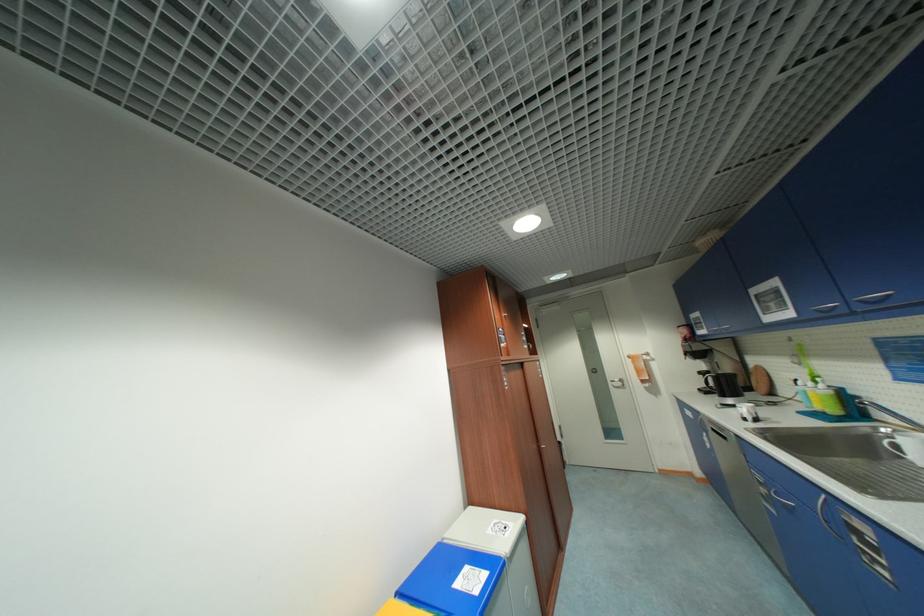
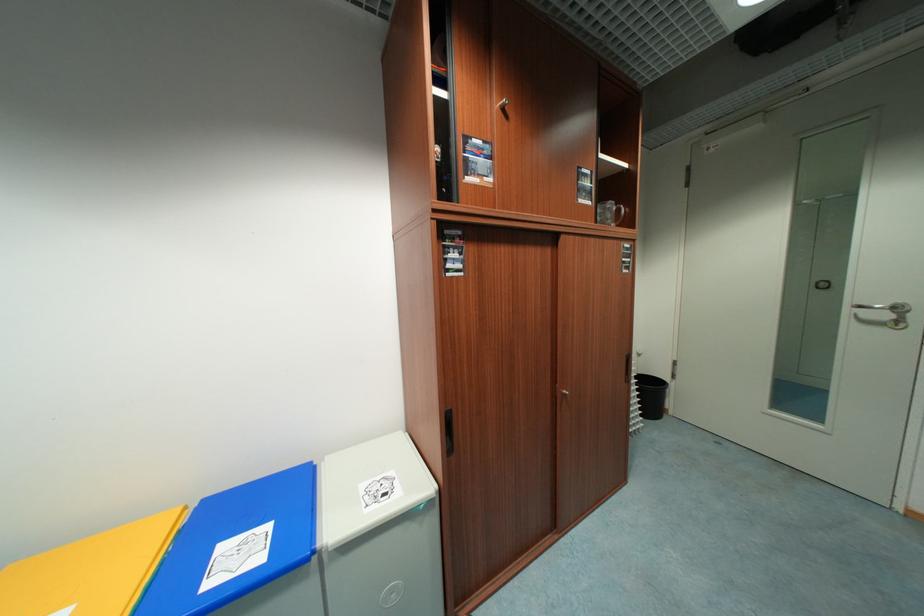
Where in the second image is the point corresponding to pixel 626 381 from the first image?

(904, 310)